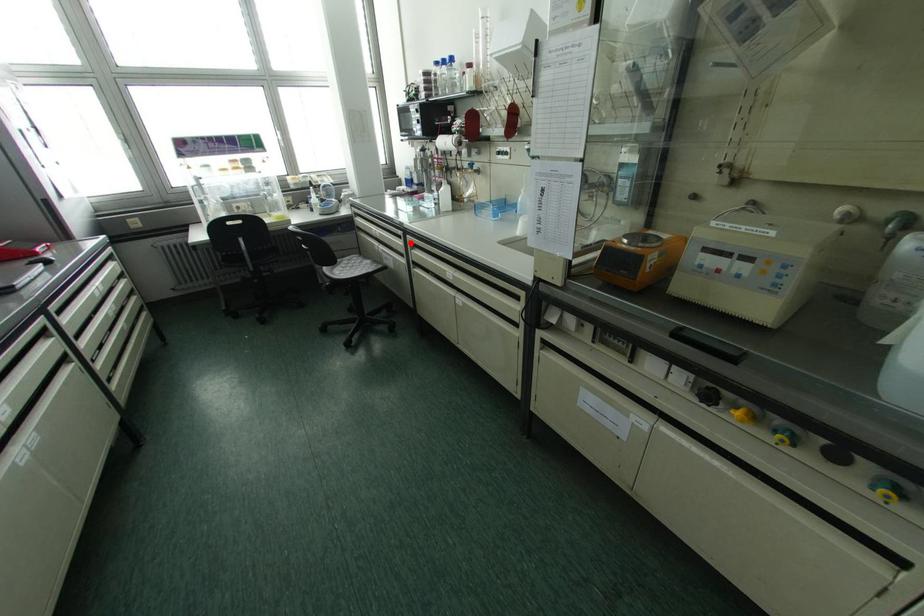
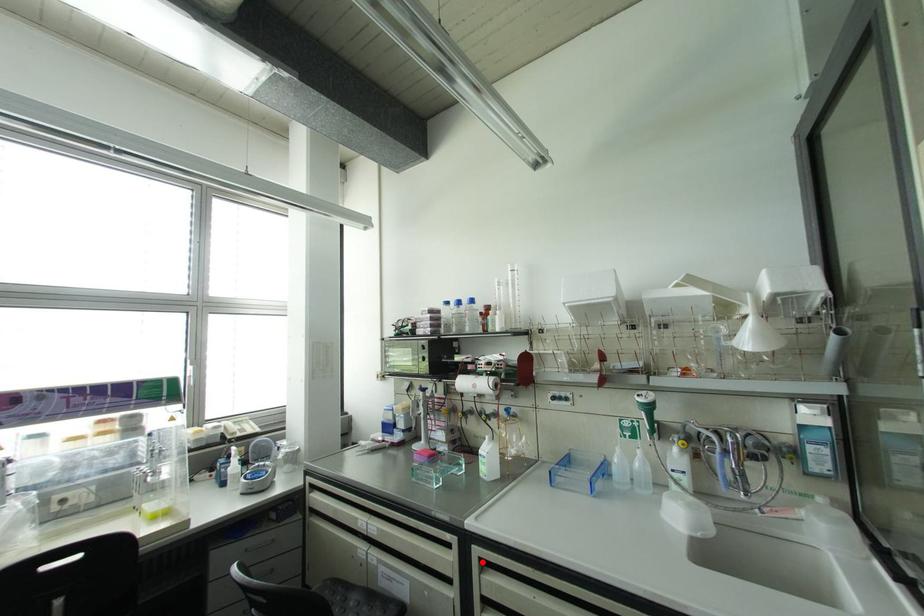
I am providing you with two images of the same scene from different viewpoints. A red point is marked on the first image and another point is marked on the second image. Does the point marked in image1 correspond to the same location as the one in image2?

Yes